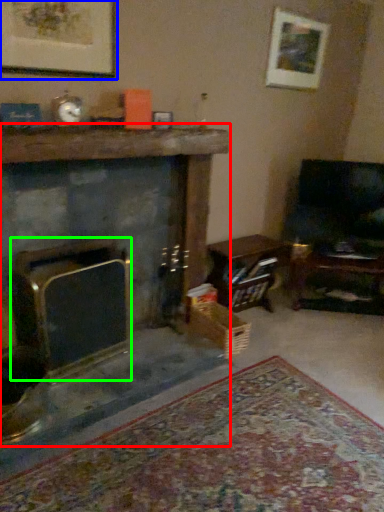
Question: Which is nearer to the fireplace (highlighted by a red box)? picture frame (highlighted by a blue box) or fireplace (highlighted by a green box).

Choices:
 (A) picture frame
 (B) fireplace

Answer: (A)